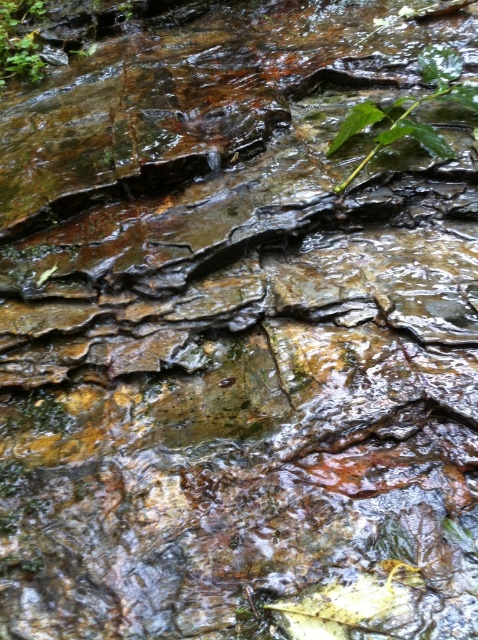
You are standing near the stream and want to reach the green leafy plant at upper right. The stream is 1.5 meters wide. Can you step over the stream to get to the plant without getting your shoes wet?

The distance between you and the green leafy plant at upper right is 1.85 meters, which is greater than the stream width of 1.5 meters. Therefore, stepping over the stream might not be possible as the distance is too far. You might need to find another way to reach the plant without getting your shoes wet.

You are standing at the center of the rocky surface in the image. Looking towards the upper right corner, can you see the green leafy plant at upper right? Please explain its position relative to the center.

Yes, the green leafy plant at upper right is located at the upper right corner of the image, which is northeast of the center point. Its 2D coordinates are at point (x=412, y=108), meaning it is positioned 17.0 percent from the left edge and 86.2 percent from the top edge of the image.